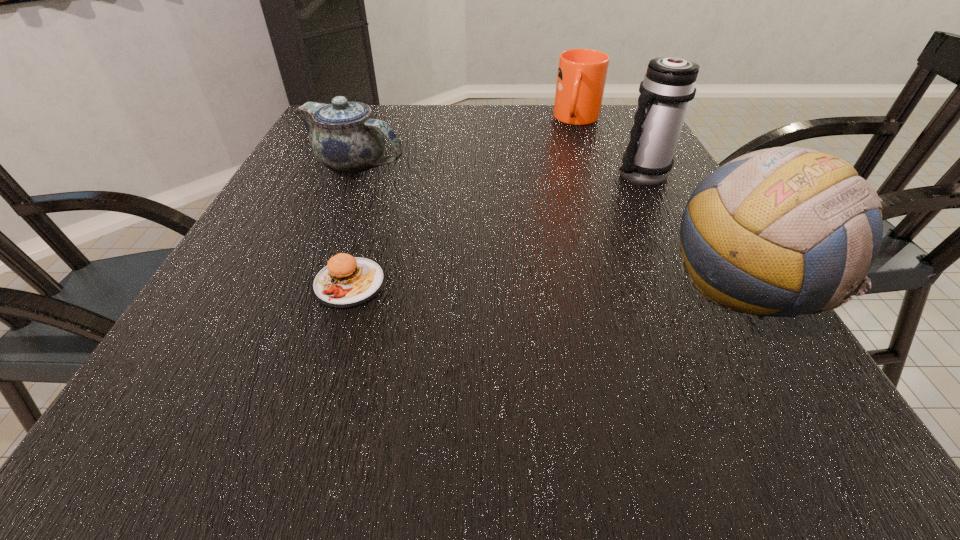
Where is `free region located from the spout of the chinaware`? free region located from the spout of the chinaware is located at coordinates (426, 197).

Where is `free space located from the spout of the chinaware`? free space located from the spout of the chinaware is located at coordinates (499, 237).

Where is `blank area located 0.350m from the spout of the chinaware`? This screenshot has height=540, width=960. blank area located 0.350m from the spout of the chinaware is located at coordinates (508, 241).

Where is `vacant space located on the side with the handle of the thermos bottle`? vacant space located on the side with the handle of the thermos bottle is located at coordinates (524, 260).

Where is `free region located on the side with the handle of the thermos bottle`? The image size is (960, 540). free region located on the side with the handle of the thermos bottle is located at coordinates (574, 222).

You are a GUI agent. You are given a task and a screenshot of the screen. Output one action in this format:
    pyautogui.click(x=<x>, y=<y>)
    Task: Click on the free space located on the side with the handle of the thermos bottle
    This screenshot has height=540, width=960.
    Given the screenshot: What is the action you would take?
    pyautogui.click(x=540, y=247)

Image resolution: width=960 pixels, height=540 pixels. I want to click on object located at the far edge, so click(581, 77).

At what (x,y) coordinates should I click in order to perform the action: click on object that is at the near edge. Please return your answer as a coordinate pair (x, y). The image size is (960, 540). Looking at the image, I should click on (791, 224).

At what (x,y) coordinates should I click in order to perform the action: click on object present at the left edge. Please return your answer as a coordinate pair (x, y). This screenshot has width=960, height=540. Looking at the image, I should click on (344, 136).

Image resolution: width=960 pixels, height=540 pixels. I want to click on volleyball that is positioned at the right edge, so click(791, 224).